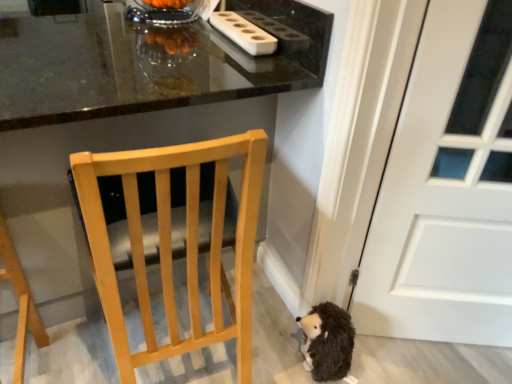
Question: Considering their positions, is brown fuzzy hedgehog at lower right located in front of or behind glossy black table at upper center?

Choices:
 (A) behind
 (B) front

Answer: (A)

Question: Is point (334, 306) positioned closer to the camera than point (241, 6)?

Choices:
 (A) farther
 (B) closer

Answer: (B)

Question: Based on their relative distances, which object is farther from the light wood chair at center?

Choices:
 (A) brown fuzzy hedgehog at lower right
 (B) white matte door at right
 (C) glossy black table at upper center
 (D) white plastic holder at upper center

Answer: (D)

Question: Which of these objects is positioned farthest from the light wood chair at center?

Choices:
 (A) brown fuzzy hedgehog at lower right
 (B) white matte door at right
 (C) white plastic holder at upper center
 (D) glossy black table at upper center

Answer: (C)